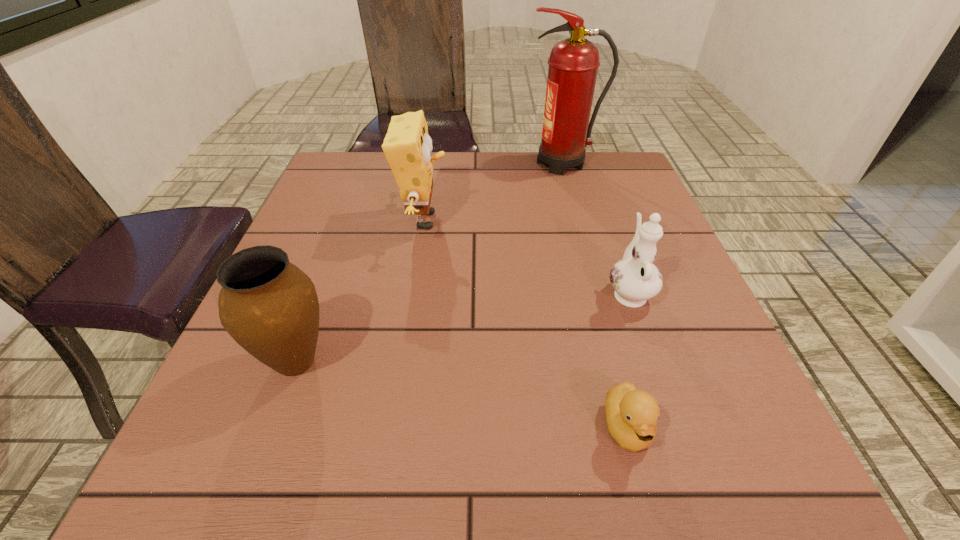
Identify which object is the nearest to the shortest object. Please provide its 2D coordinates. Your answer should be formatted as a tuple, i.e. [(x, y)], where the tuple contains the x and y coordinates of a point satisfying the conditions above.

[(635, 279)]

Locate an element on the screen. The height and width of the screenshot is (540, 960). object identified as the fourth closest to the third farthest object is located at coordinates pos(270,307).

This screenshot has width=960, height=540. In order to click on vacant space that satisfies the following two spatial constraints: 1. at the spout of the chinaware; 2. on the face of the sponge in this screenshot , I will do `click(604, 220)`.

Where is `free region that satisfies the following two spatial constraints: 1. on the face of the second object from left to right; 2. at the spout of the third nearest object`? free region that satisfies the following two spatial constraints: 1. on the face of the second object from left to right; 2. at the spout of the third nearest object is located at coordinates (413, 292).

Locate an element on the screen. free point that satisfies the following two spatial constraints: 1. at the spout of the third farthest object; 2. on the front-facing side of the fire extinguisher is located at coordinates (584, 164).

I want to click on blank space that satisfies the following two spatial constraints: 1. on the front-facing side of the tallest object; 2. at the spout of the chinaware, so click(599, 292).